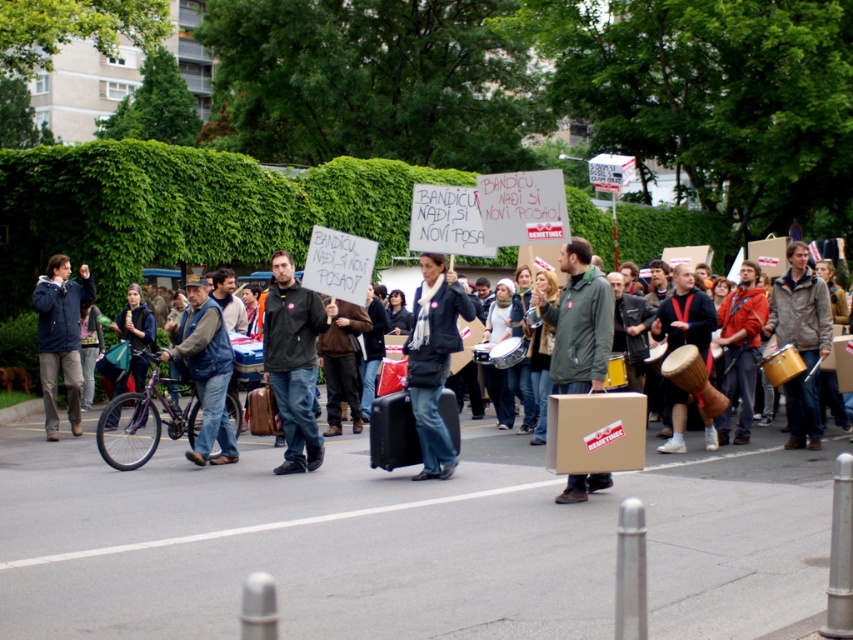
Question: Is matte black suitcase at center smaller than golden drum at center?

Choices:
 (A) no
 (B) yes

Answer: (B)

Question: Is dark blue jacket at center to the right of denim jacket at center from the viewer's perspective?

Choices:
 (A) yes
 (B) no

Answer: (A)

Question: Which object appears closest to the camera in this image?

Choices:
 (A) matte black suitcase at center
 (B) denim jacket at center
 (C) matte green jacket at center
 (D) golden drum at center

Answer: (C)

Question: Which of these objects is positioned closest to the matte blue jacket at left?

Choices:
 (A) dark blue jacket at center
 (B) matte black suitcase at center
 (C) denim jacket at center

Answer: (B)

Question: Which is farther from the matte green jacket at center?

Choices:
 (A) matte black suitcase at center
 (B) matte black jacket at center

Answer: (A)

Question: Is matte green jacket at center positioned before denim jacket at center?

Choices:
 (A) no
 (B) yes

Answer: (B)